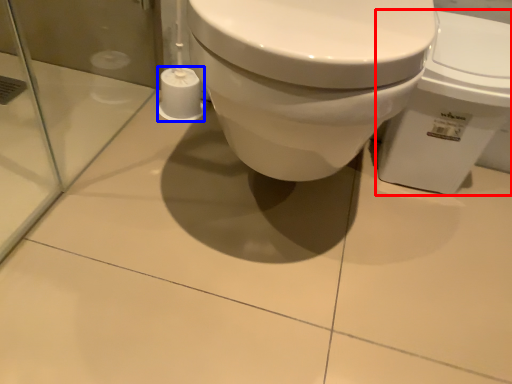
Question: Which point is further to the camera, toilet (highlighted by a red box) or toilet paper (highlighted by a blue box)?

Choices:
 (A) toilet
 (B) toilet paper

Answer: (B)